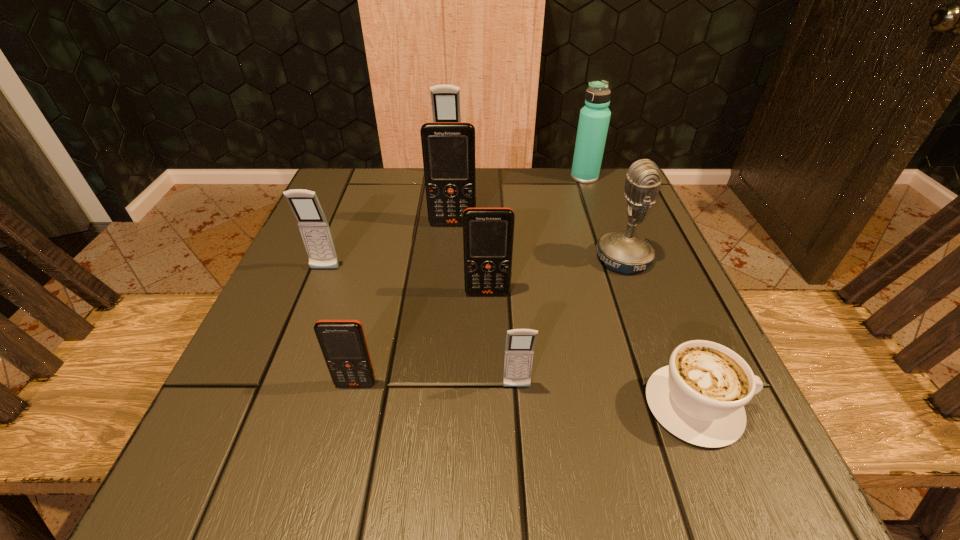
Locate an element on the screen. Image resolution: width=960 pixels, height=540 pixels. vacant area situated on the front-facing side of the microphone is located at coordinates (406, 258).

At what (x,y) coordinates should I click in order to perform the action: click on free point located on the front-facing side of the second farthest gray cellular telephone. Please return your answer as a coordinate pair (x, y). The width and height of the screenshot is (960, 540). Looking at the image, I should click on (304, 321).

The height and width of the screenshot is (540, 960). Identify the location of free space located 0.060m on the screen of the sixth farthest object. (489, 323).

Where is `blank space located 0.050m on the screen of the second object from left to right`? blank space located 0.050m on the screen of the second object from left to right is located at coordinates (348, 420).

At what (x,y) coordinates should I click in order to perform the action: click on vacant area situated on the front-facing side of the nearest gray cellular telephone. Please return your answer as a coordinate pair (x, y). The image size is (960, 540). Looking at the image, I should click on (519, 424).

The width and height of the screenshot is (960, 540). Find the location of `thermos bottle that is positioned at the far edge`. thermos bottle that is positioned at the far edge is located at coordinates (594, 118).

Locate an element on the screen. This screenshot has width=960, height=540. object present at the near edge is located at coordinates (699, 397).

What are the coordinates of `thermos bottle at the right edge` in the screenshot? It's located at (594, 118).

Locate an element on the screen. This screenshot has width=960, height=540. microphone that is positioned at the right edge is located at coordinates (623, 251).

Identify the location of cappuccino that is at the right edge. click(699, 397).